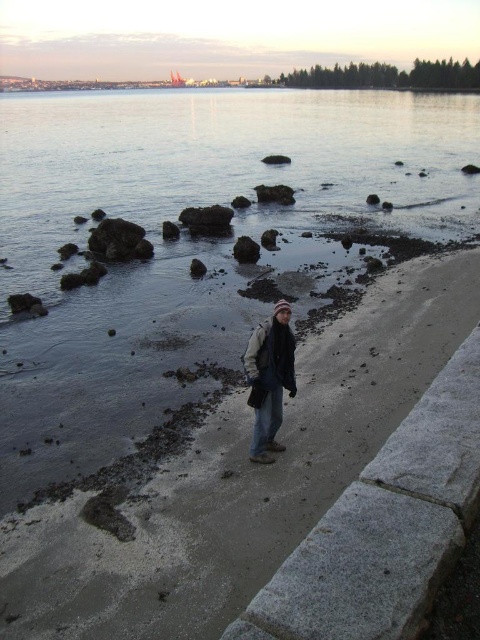
Question: Can you confirm if gray stone pavement at lower right is positioned below dark gray knit hat at center?

Choices:
 (A) yes
 (B) no

Answer: (A)

Question: Based on their relative distances, which object is nearer to the gray stone pavement at lower right?

Choices:
 (A) gray concrete curb at lower right
 (B) dark gray knit hat at center
 (C) clear water at center

Answer: (B)

Question: Which point appears closest to the camera in this image?

Choices:
 (A) (274, 465)
 (B) (427, 132)

Answer: (A)

Question: Does gray stone pavement at lower right appear over gray concrete curb at lower right?

Choices:
 (A) no
 (B) yes

Answer: (A)

Question: Is gray stone pavement at lower right wider than dark gray knit hat at center?

Choices:
 (A) yes
 (B) no

Answer: (A)

Question: Which point appears closest to the camera in this image?

Choices:
 (A) (274, 420)
 (B) (340, 339)

Answer: (A)